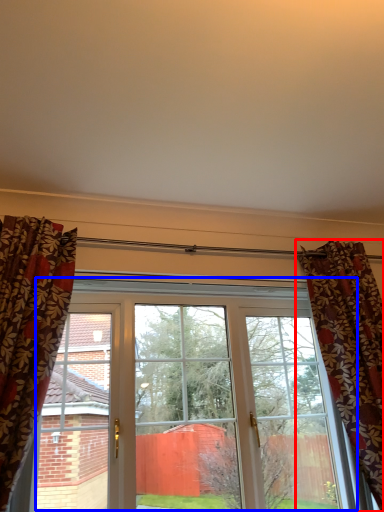
Question: Which object is closer to the camera taking this photo, curtain (highlighted by a red box) or window (highlighted by a blue box)?

Choices:
 (A) curtain
 (B) window

Answer: (A)